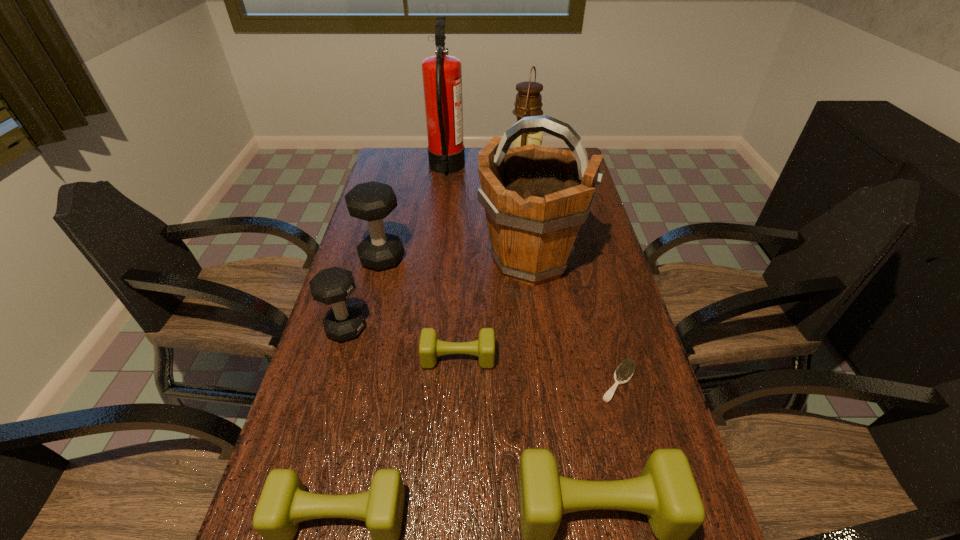
Identify the location of oil lamp present at the right edge. (528, 103).

Where is `scrubbing brush situated at the right edge`? The width and height of the screenshot is (960, 540). scrubbing brush situated at the right edge is located at coordinates [624, 372].

At what (x,y) coordinates should I click in order to perform the action: click on object that is at the far right corner. Please return your answer as a coordinate pair (x, y). The image size is (960, 540). Looking at the image, I should click on (528, 103).

In the image, there is a desktop. Where is `free region at the left edge`? The height and width of the screenshot is (540, 960). free region at the left edge is located at coordinates (344, 385).

The height and width of the screenshot is (540, 960). I want to click on free location at the right edge of the desktop, so click(593, 306).

In the image, there is a desktop. Where is `free space at the far left corner`? This screenshot has height=540, width=960. free space at the far left corner is located at coordinates (x=402, y=149).

The height and width of the screenshot is (540, 960). I want to click on unoccupied area between the tallest dumbbell and the fire extinguisher, so click(415, 213).

I want to click on free space between the sixth shortest object and the red fire extinguisher, so tap(415, 213).

Locate an element on the screen. The image size is (960, 540). empty space that is in between the bucket and the nearer gray dumbbell is located at coordinates (438, 294).

You are a GUI agent. You are given a task and a screenshot of the screen. Output one action in this format:
    pyautogui.click(x=<x>, y=<y>)
    Task: Click on the object that can be found as the fifth closest to the red fire extinguisher
    This screenshot has height=540, width=960.
    Given the screenshot: What is the action you would take?
    pyautogui.click(x=430, y=348)